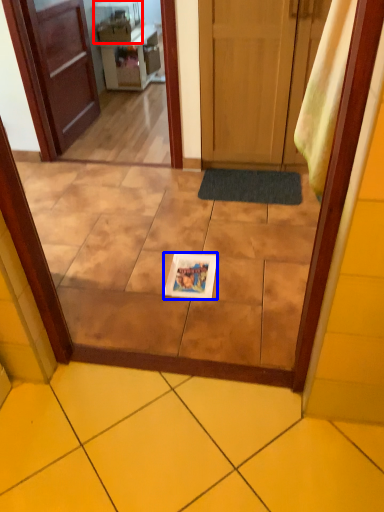
Question: Which object appears closest to the camera in this image, appliance (highlighted by a red box) or copy (highlighted by a blue box)?

Choices:
 (A) appliance
 (B) copy

Answer: (B)